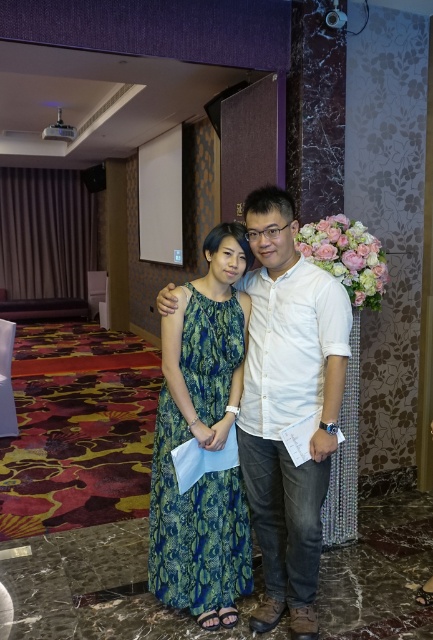
Based on the photo, you are at the banquet hall and want to move from the point marked as point (316,376) to the point marked as point (225,388). Which direction should you move in to reach your destination?

To move from point (316,376) to point (225,388), you should move upwards because point (316,376) is in front of point (225,388), indicating it is closer to the viewer. Moving towards the destination would require moving away from the viewer, which corresponds to an upward direction in the image.

You are standing in the banquet hall and want to find the white cotton shirt at center. According to the coordinates, where should you look?

The white cotton shirt at center is located at the coordinates point (288, 404).